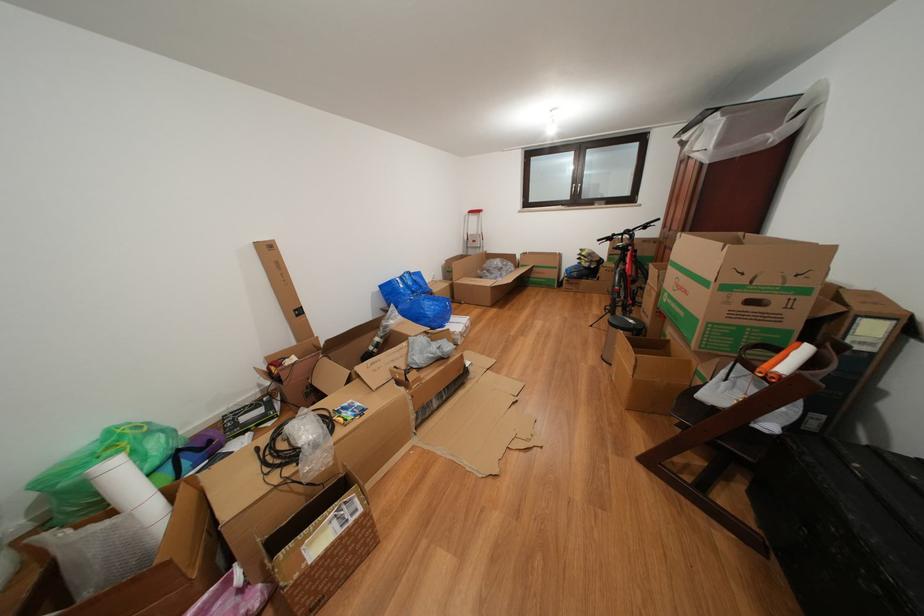
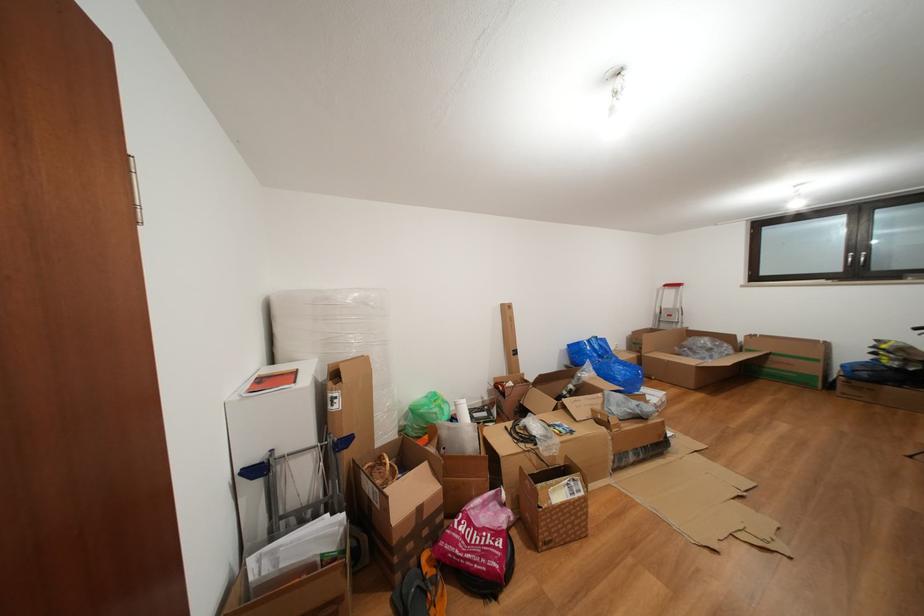
In the second image, find the point that corresponds to [564,273] in the first image.

(824, 366)